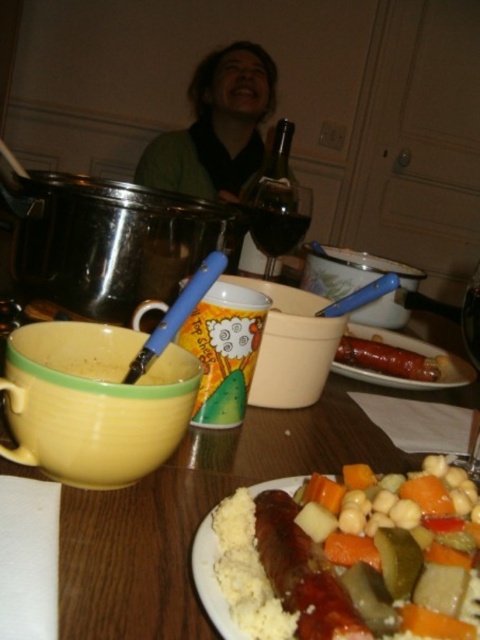
You are a food delivery person who just arrived at the house. You need to place a small delivery box on the table without covering any existing items. The box is 3 inches wide. Is there enough space between the matte white plate with mixed vegetables and sausage at center and the edge of the table to fit the box?

The matte white plate with mixed vegetables and sausage at center is 8.16 inches from the camera, but the distance from the plate to the table edge isn not provided. Without knowing the table size or plate position relative to the edge, I can not confirm if the box will fit.

You are a person with an arm length of 30 inches. You want to reach for the dark glass wine at center from your current position. Can you comfortably reach it without moving your chair?

The dark glass wine at center is 31.52 inches away from the viewer. Since your arm length is 30 inches, you cannot comfortably reach it without moving your chair.

You are setting the table for a dinner party and need to place the dark glass wine at center and the transparent glass at upper center. According to the scene, which glass is shorter?

The dark glass wine at center is shorter than the transparent glass at upper center, so the dark glass wine at center is the shorter one.